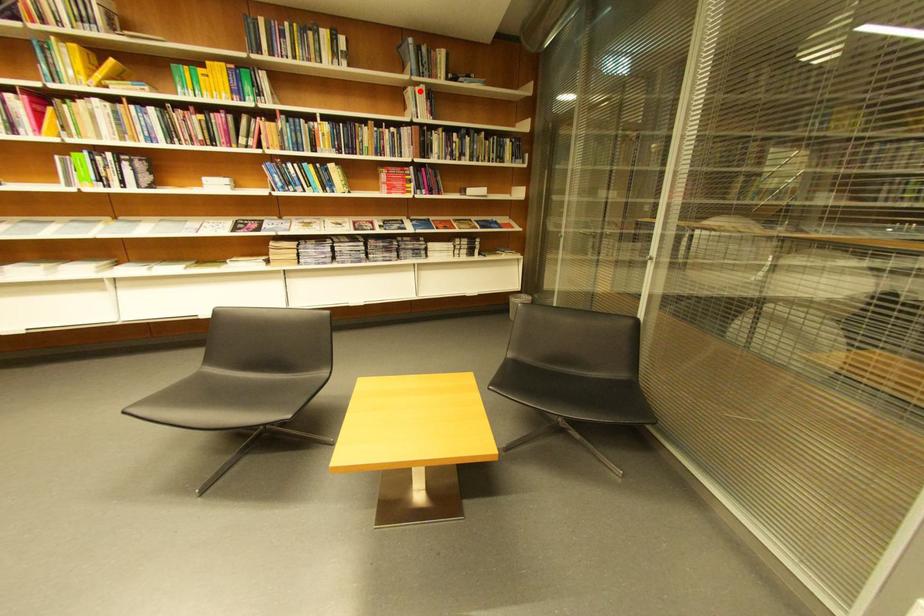
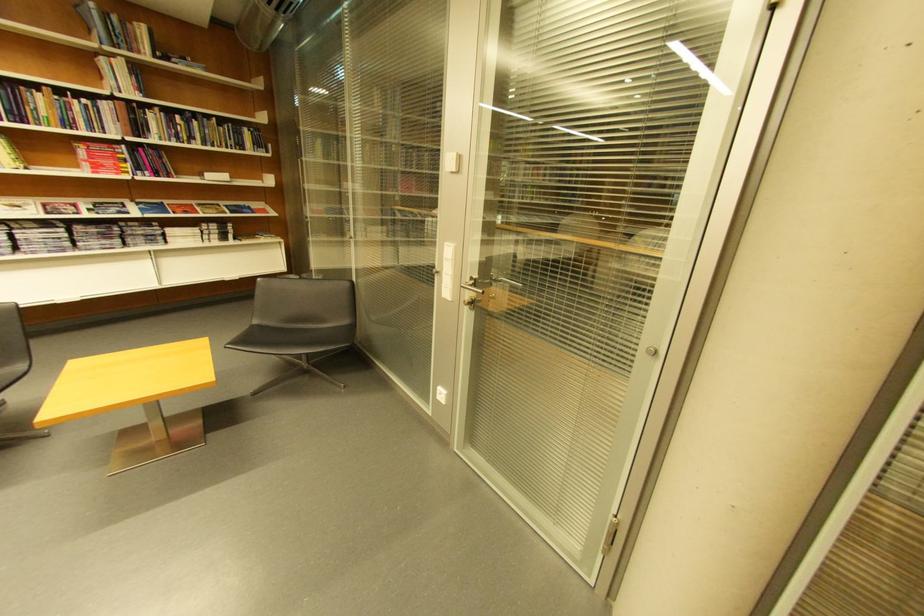
Question: I am providing you with two images of the same scene from different viewpoints. A red point is shown in image1. For the corresponding object point in image2, is it positioned nearer or farther from the camera?

Choices:
 (A) Nearer
 (B) Farther

Answer: (B)